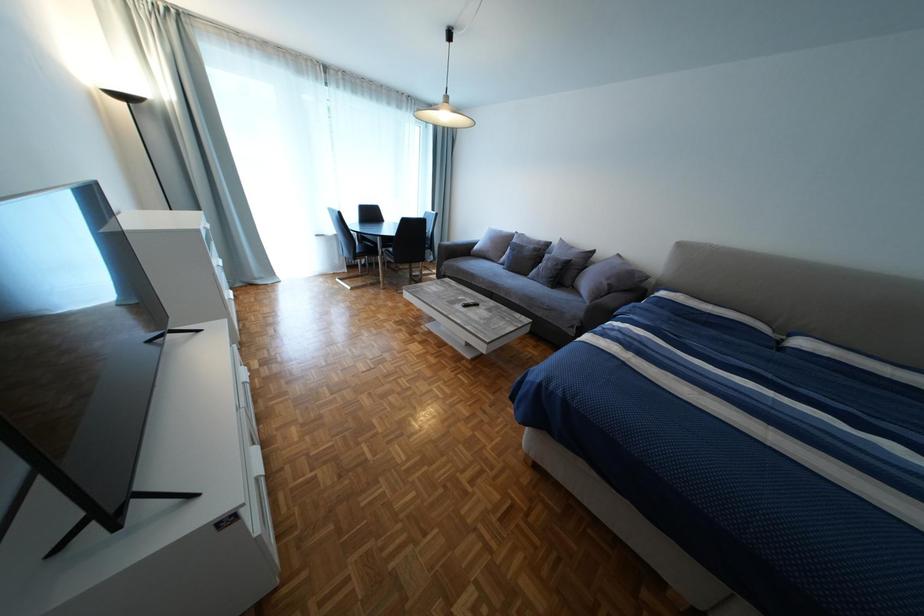
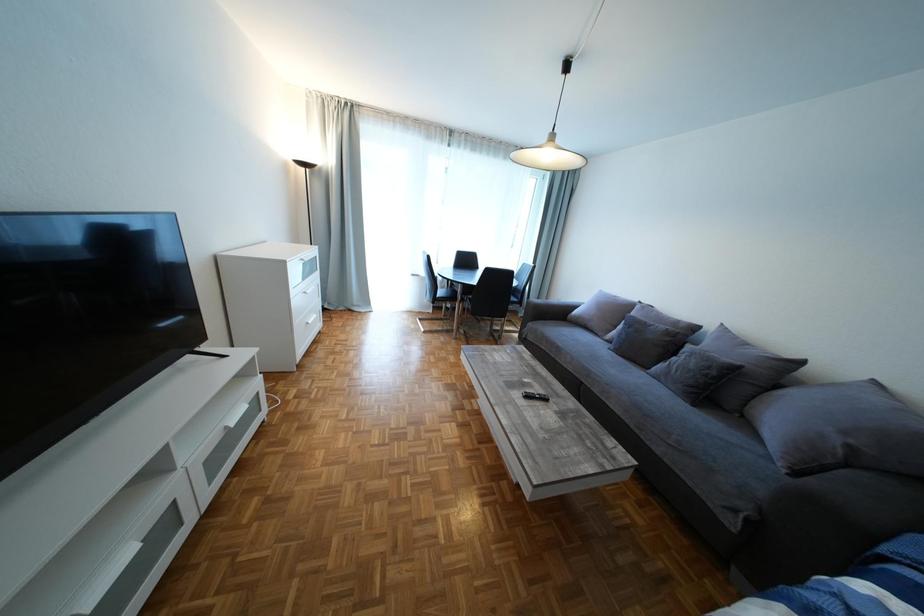
Question: The camera is either moving clockwise (left) or counter-clockwise (right) around the object. The first image is from the beginning of the video and the second image is from the end. Is the camera moving left or right when shooting the video?

Choices:
 (A) Left
 (B) Right

Answer: (B)